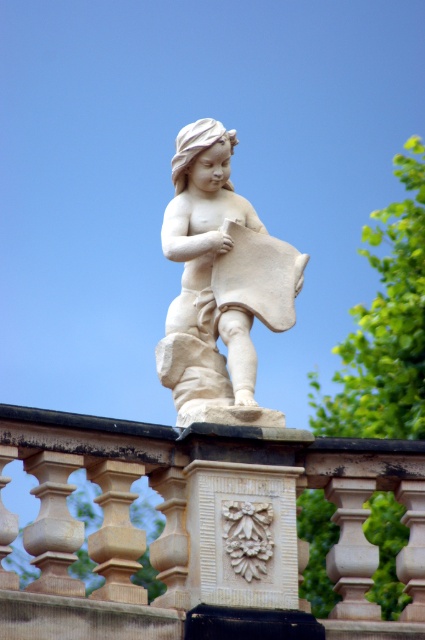
Who is higher up, white stone balustrade at center or white marble statue at center?

Positioned higher is white marble statue at center.

Does point (280, 620) come farther from viewer compared to point (249, 348)?

No.

Who is more distant from viewer, (107, 605) or (184, 275)?

The point (184, 275) is behind.

Locate an element on the screen. The image size is (425, 640). white stone balustrade at center is located at coordinates (204, 529).